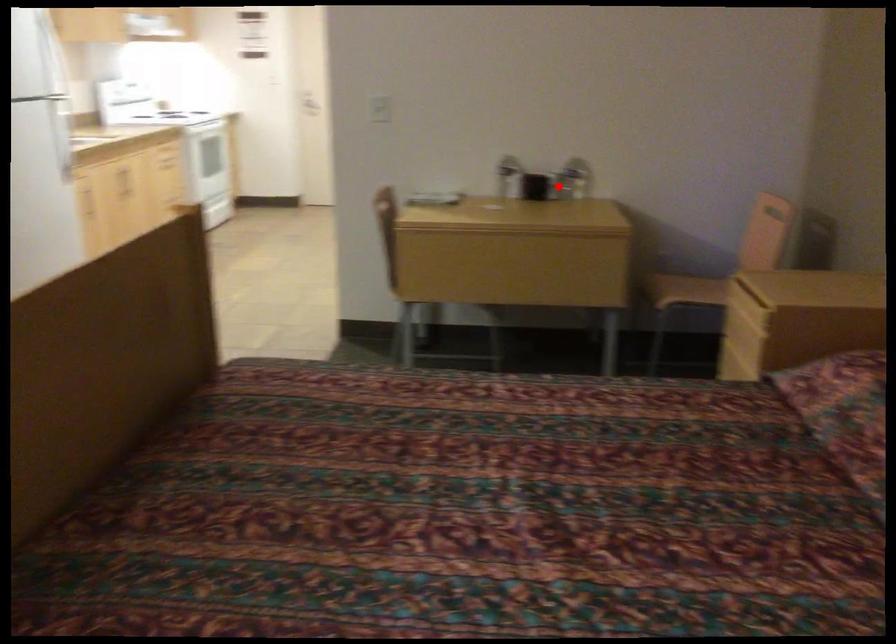
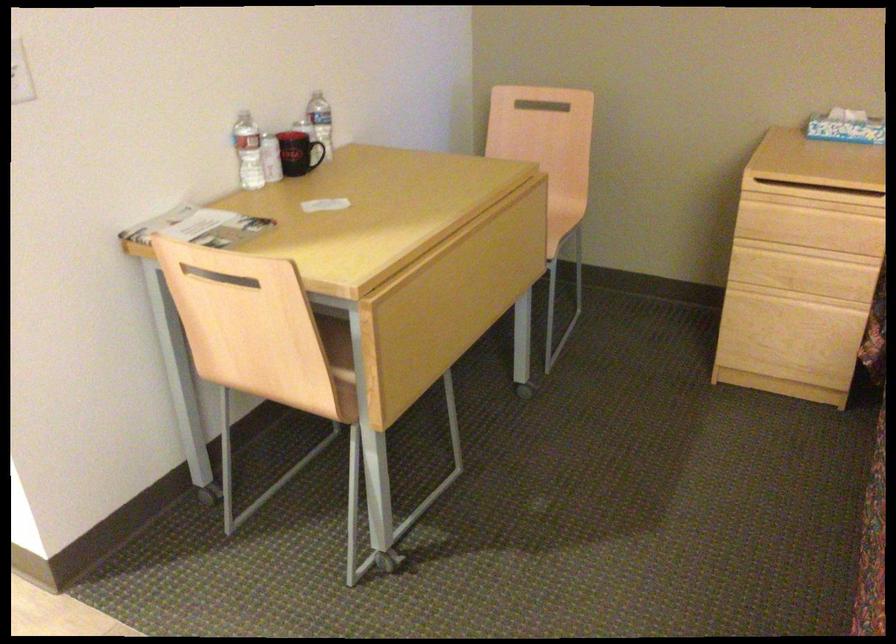
In the second image, find the point that corresponds to the highlighted location in the first image.

(321, 153)